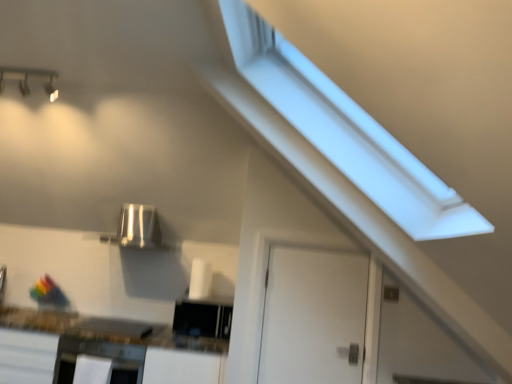
Question: Is satin silver appliance at center, the first appliance in the top-to-bottom sequence, bigger or smaller than white glossy countertop at lower left?

Choices:
 (A) big
 (B) small

Answer: (B)

Question: In the image, is satin silver appliance at center, marked as the second appliance in a bottom-to-top arrangement, positioned in front of or behind white glossy countertop at lower left?

Choices:
 (A) behind
 (B) front

Answer: (A)

Question: Which of these objects is positioned farthest from the satin black oven at lower left?

Choices:
 (A) white matte door at center
 (B) black glossy microwave at center, arranged as the second appliance when viewed from the top
 (C) white glossy countertop at lower left
 (D) satin silver appliance at center, the first appliance in the top-to-bottom sequence
 (E) matte silver light fixture at upper left

Answer: (E)

Question: Which of these objects is positioned closest to the satin black oven at lower left?

Choices:
 (A) white glossy countertop at lower left
 (B) black glossy microwave at center, arranged as the second appliance when viewed from the top
 (C) matte silver light fixture at upper left
 (D) white matte door at center
 (E) satin silver appliance at center, the 2th appliance in the right-to-left sequence

Answer: (A)